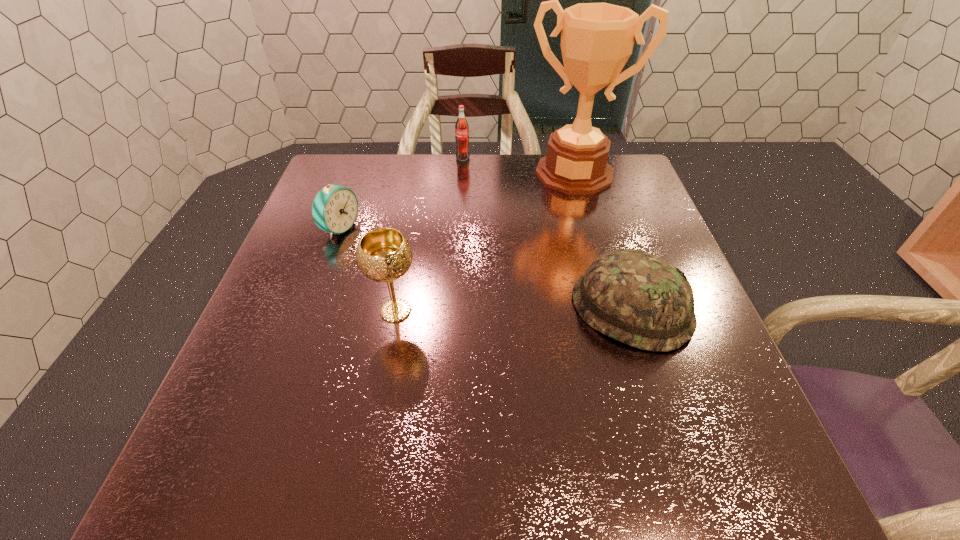
Locate an element on the screen. This screenshot has height=540, width=960. chalice is located at coordinates (384, 254).

At what (x,y) coordinates should I click in order to perform the action: click on headwear. Please return your answer as a coordinate pair (x, y). Looking at the image, I should click on (637, 298).

I want to click on the leftmost object, so click(335, 207).

Where is `alarm clock`? The height and width of the screenshot is (540, 960). alarm clock is located at coordinates (335, 207).

In order to click on the tallest object in this screenshot , I will do tap(597, 39).

Where is `the third object from left to right`? This screenshot has height=540, width=960. the third object from left to right is located at coordinates (461, 127).

Locate an element on the screen. The height and width of the screenshot is (540, 960). soda bottle is located at coordinates (461, 127).

Where is `vacant space located 0.260m on the right of the chalice`? vacant space located 0.260m on the right of the chalice is located at coordinates (546, 311).

Image resolution: width=960 pixels, height=540 pixels. In order to click on free point located on the left of the headwear in this screenshot , I will do `click(463, 309)`.

At what (x,y) coordinates should I click in order to perform the action: click on vacant area situated on the front-facing side of the alarm clock. Please return your answer as a coordinate pair (x, y). Looking at the image, I should click on (x=467, y=283).